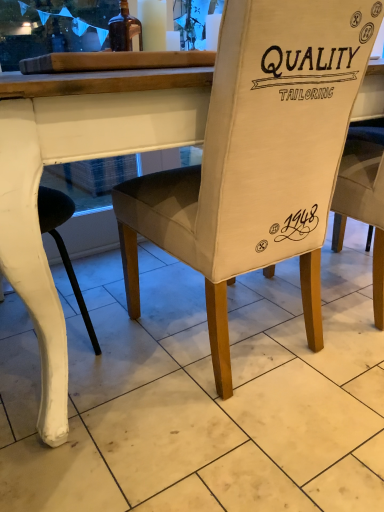
Locate an element on the screen. This screenshot has height=512, width=384. free spot below beige fabric chair at center (from a real-world perspective) is located at coordinates (226, 337).